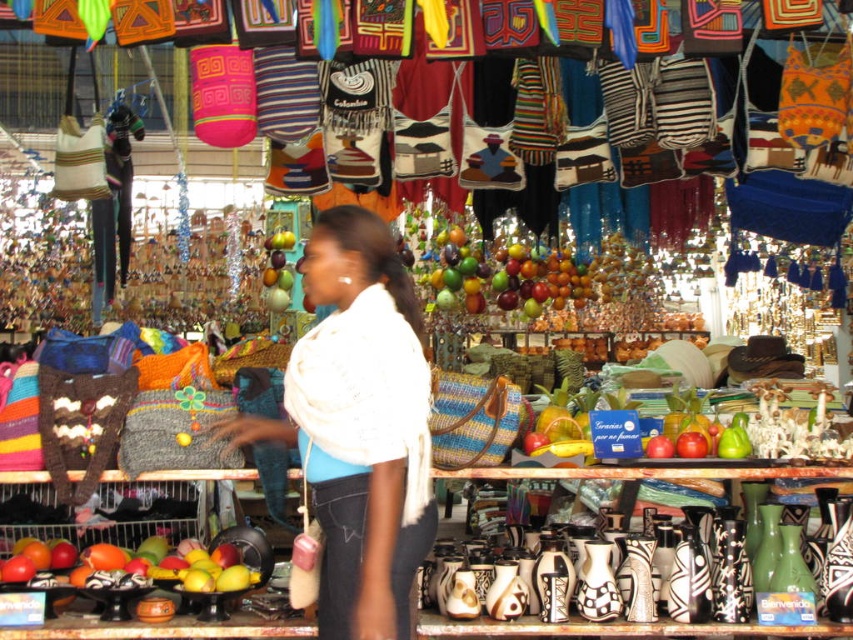
You are a customer at the market and want to buy the white soft scarf at center. The vendor tells you that the scarf is placed exactly at coordinates point 0.667, 0.421. Can you estimate its position based on the scene description?

The white soft scarf at center is located at point (358,426), which means it is positioned two thirds of the way from the left edge and slightly above the middle vertically in the scene.

You are a customer at the market and want to find the white soft scarf at center. Based on its 2D coordinates, where should you look relative to the shelves?

The white soft scarf at center is located at coordinates 0.667 on the x axis and 0.421 on the y axis, so you should look towards the upper right portion of the shelves.